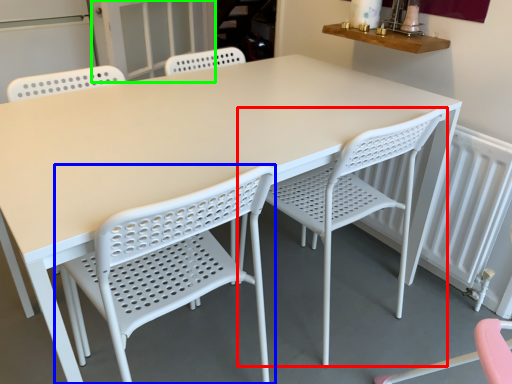
Question: Which object is positioned farthest from chair (highlighted by a red box)? Select from chair (highlighted by a blue box) and screen door (highlighted by a green box).

Choices:
 (A) chair
 (B) screen door

Answer: (B)